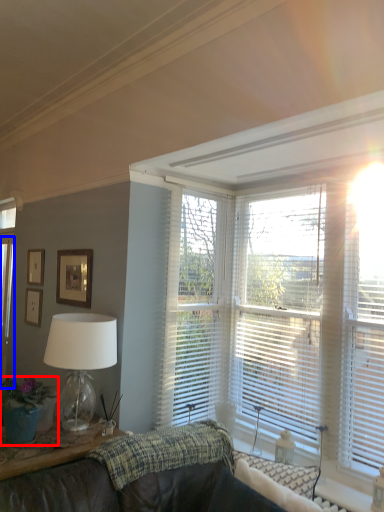
Question: Which object is closer to the camera taking this photo, houseplant (highlighted by a red box) or glass door (highlighted by a blue box)?

Choices:
 (A) houseplant
 (B) glass door

Answer: (A)